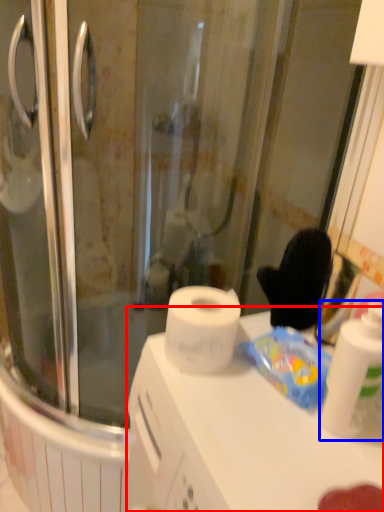
Question: Which point is further to the camera, counter top (highlighted by a red box) or cleaning product (highlighted by a blue box)?

Choices:
 (A) counter top
 (B) cleaning product

Answer: (B)